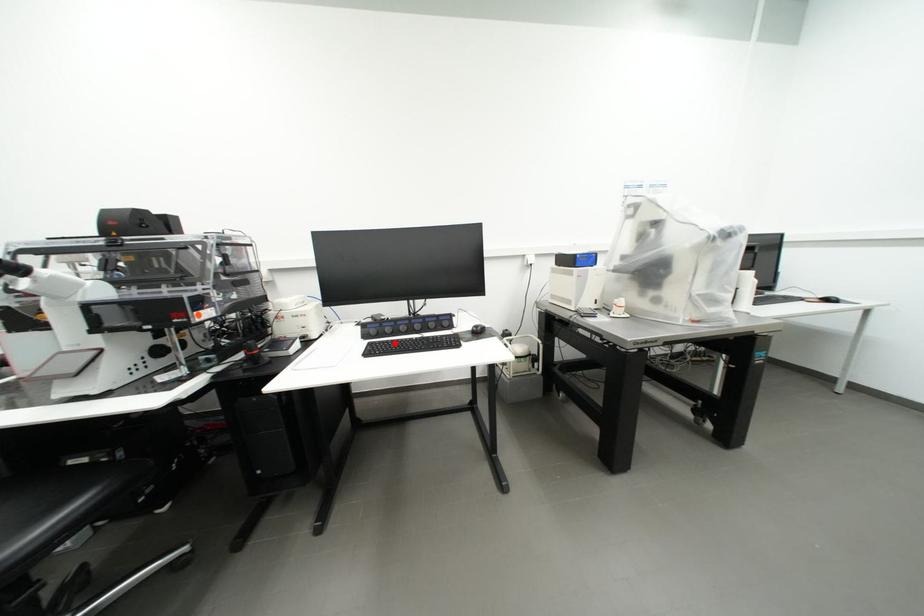
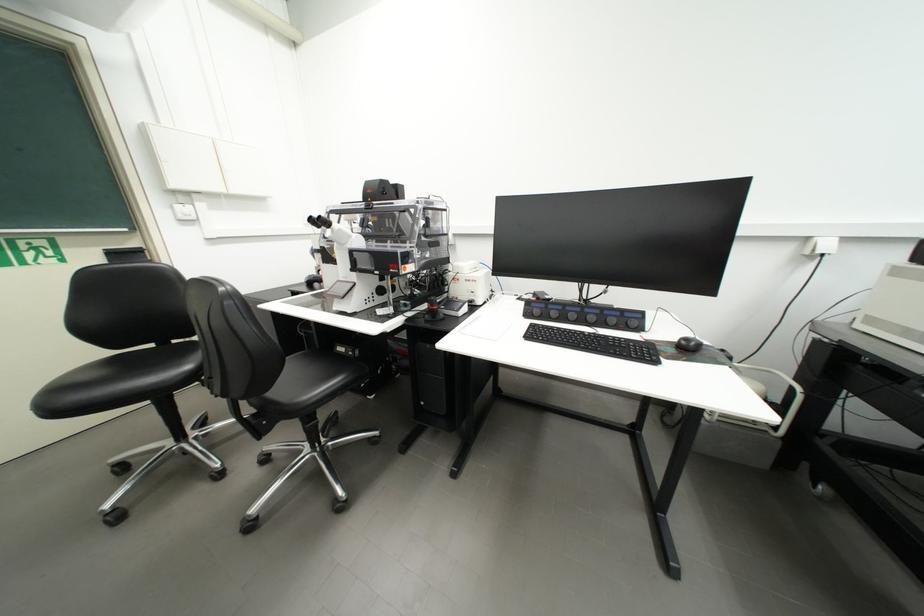
The point at the highlighted location is marked in the first image. Where is the corresponding point in the second image?

(560, 330)